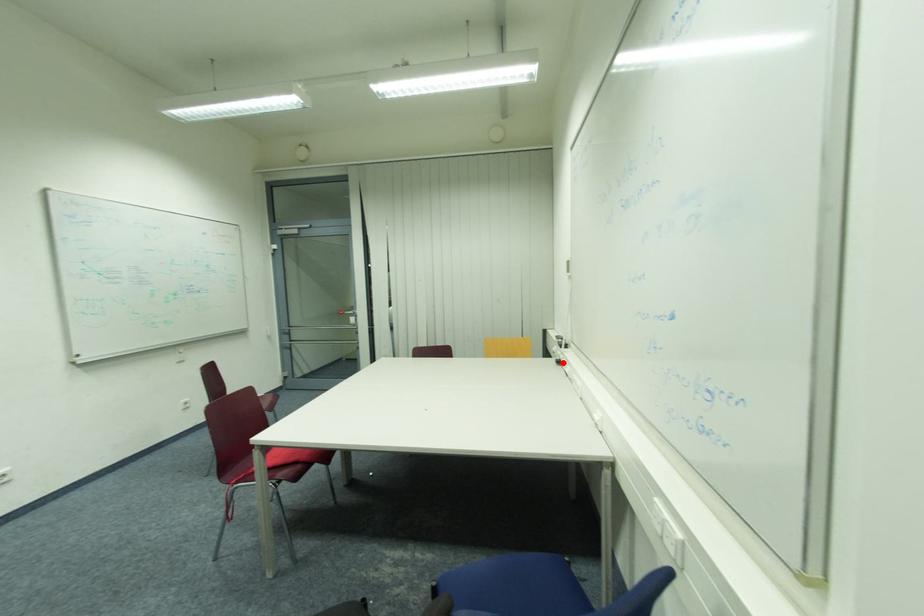
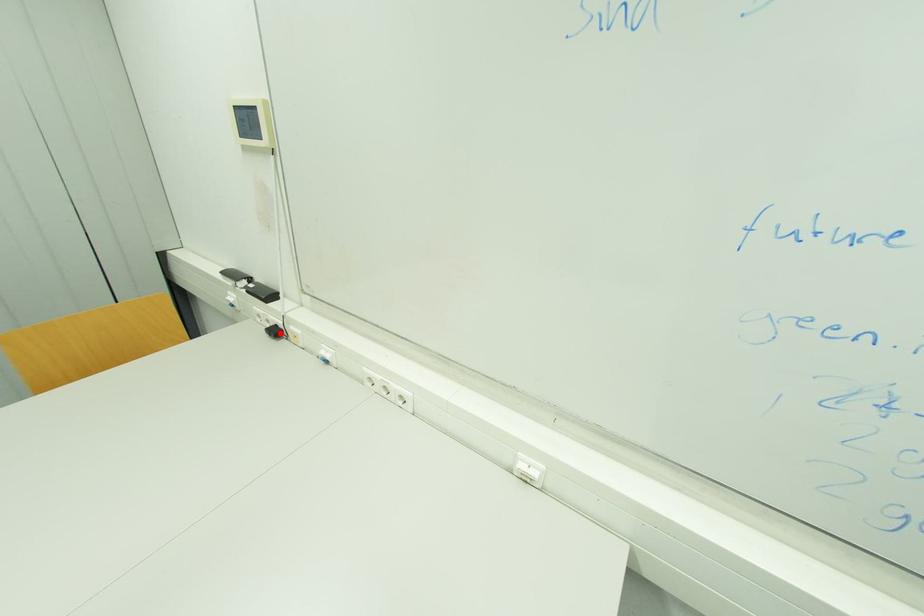
I am providing you with two images of the same scene from different viewpoints. A red point is marked on the first image and another point is marked on the second image. Are the points marked in image1 and image2 representing the same 3D position?

Yes